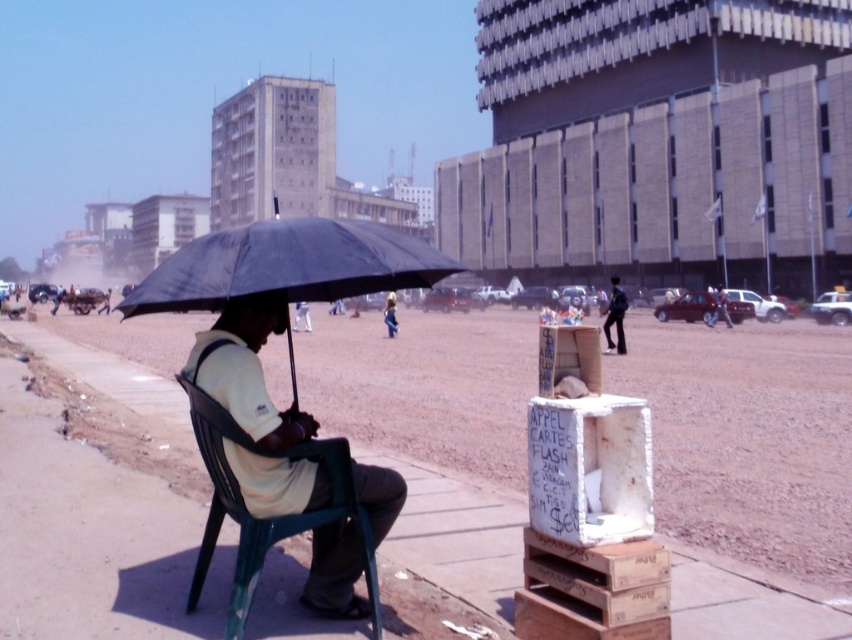
Question: Is black matte umbrella at center closer to the viewer compared to dark blue uniform at center?

Choices:
 (A) no
 (B) yes

Answer: (B)

Question: Which point is closer to the camera?

Choices:
 (A) (617, 324)
 (B) (389, 330)
 (C) (329, 300)

Answer: (C)

Question: Is black matte umbrella at center above dark blue uniform at center?

Choices:
 (A) no
 (B) yes

Answer: (B)

Question: Which point appears closest to the camera in this image?

Choices:
 (A) (390, 307)
 (B) (289, 332)
 (C) (620, 340)
 (D) (223, 637)

Answer: (D)

Question: Estimate the real-world distances between objects in this image. Which object is closer to the dark blue uniform at center?

Choices:
 (A) light blue jeans at center
 (B) black matte umbrella at center
 (C) green plastic chair at center

Answer: (A)

Question: Is the position of dark blue uniform at center more distant than that of light blue jeans at center?

Choices:
 (A) no
 (B) yes

Answer: (A)